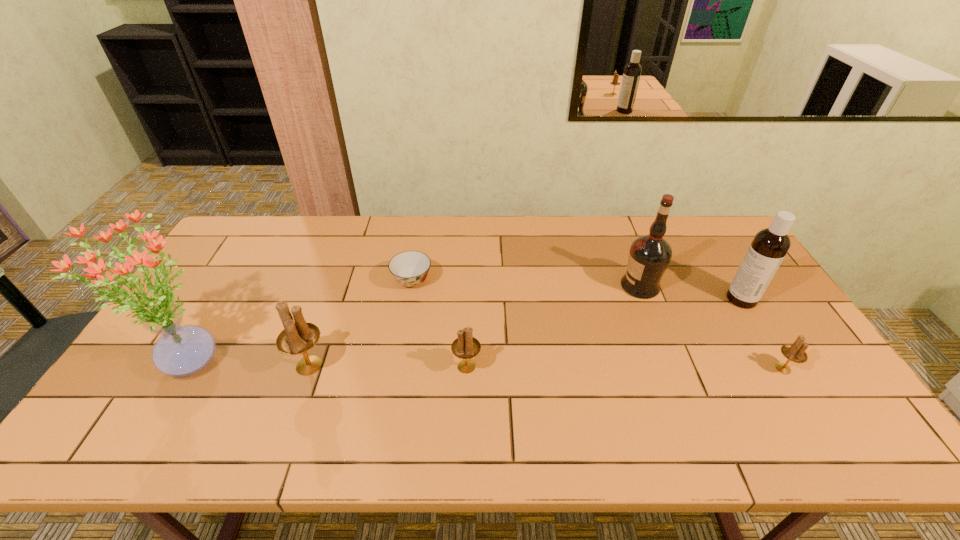
Locate an element on the screen. free space located 0.360m on the label side of the dishwasher detergent is located at coordinates (609, 299).

Identify the location of vacant space positioned 0.170m on the label side of the dishwasher detergent. The image size is (960, 540). (671, 299).

The height and width of the screenshot is (540, 960). In order to click on vacant region located 0.260m on the label side of the dishwasher detergent in this screenshot , I will do `click(641, 299)`.

At what (x,y) coordinates should I click in order to perform the action: click on candle holder that is at the near edge. Please return your answer as a coordinate pair (x, y). Looking at the image, I should click on (297, 338).

Identify the location of flower arrangement that is positioned at the near edge. The height and width of the screenshot is (540, 960). (182, 350).

This screenshot has width=960, height=540. Identify the location of object situated at the left edge. (182, 350).

At what (x,y) coordinates should I click in order to perform the action: click on candle holder that is at the right edge. Please return your answer as a coordinate pair (x, y). Image resolution: width=960 pixels, height=540 pixels. Looking at the image, I should click on (795, 352).

You are a GUI agent. You are given a task and a screenshot of the screen. Output one action in this format:
    pyautogui.click(x=<x>, y=<y>)
    Task: Click on the dishwasher detergent present at the right edge
    
    Given the screenshot: What is the action you would take?
    pyautogui.click(x=766, y=252)

At what (x,y) coordinates should I click in order to perform the action: click on object that is at the near left corner. Please return your answer as a coordinate pair (x, y). Image resolution: width=960 pixels, height=540 pixels. Looking at the image, I should click on (182, 350).

The image size is (960, 540). Identify the location of free point at the far edge. (376, 247).